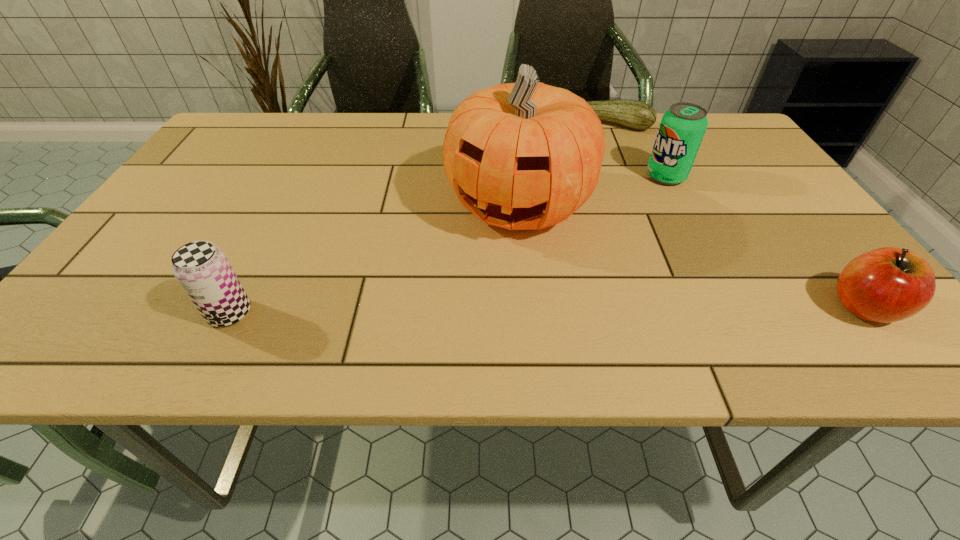
Find the location of `vacant space on the desktop that is between the leftmost object and the rightmost object and is positioned on the front-facing side of the second tallest object`. vacant space on the desktop that is between the leftmost object and the rightmost object and is positioned on the front-facing side of the second tallest object is located at coordinates (463, 310).

What are the coordinates of `vacant space on the desktop that is between the beer can and the apple and is positioned on the front-facing side of the tallest object` in the screenshot? It's located at (462, 310).

Locate an element on the screen. free space on the desktop that is between the leftmost object and the rightmost object and is positioned at the stem end of the shortest object is located at coordinates (536, 310).